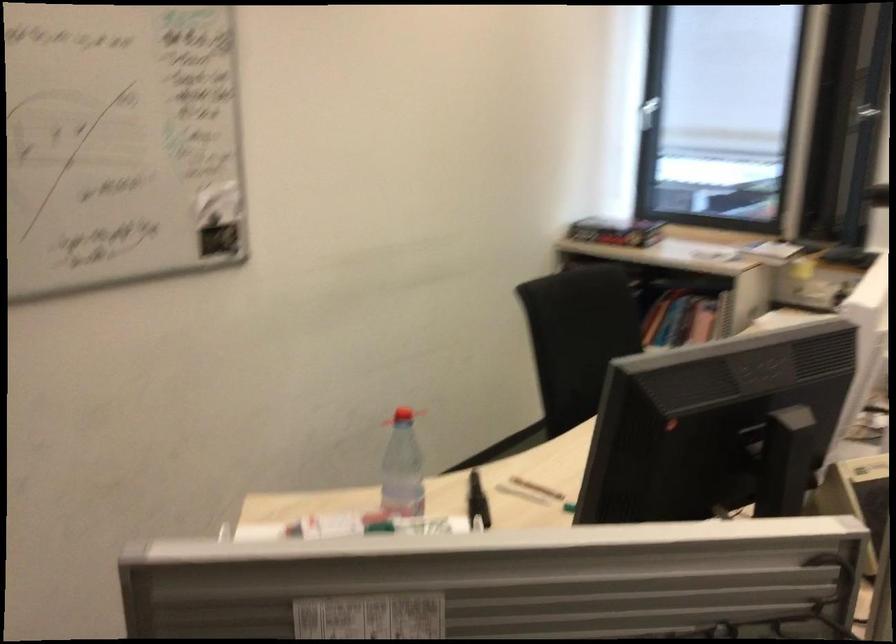
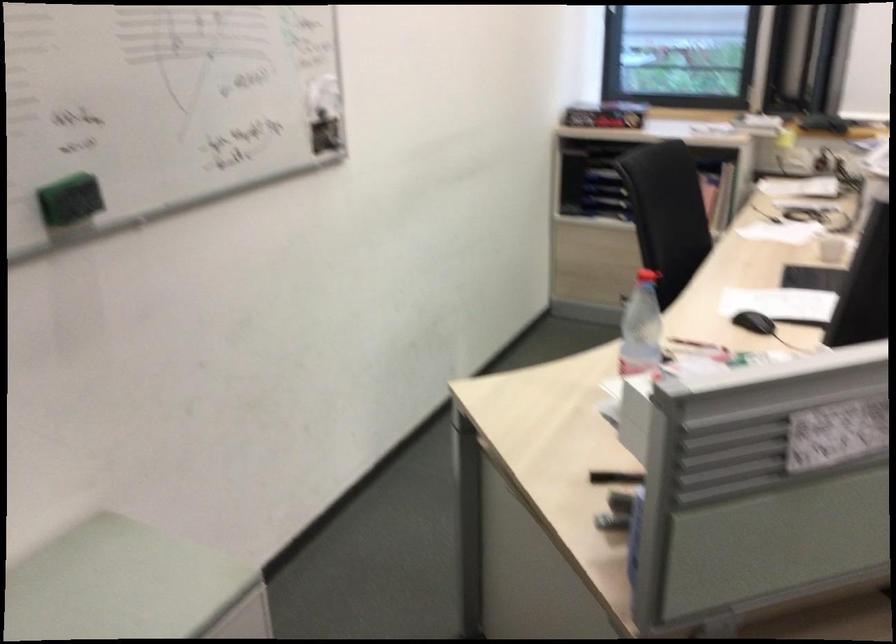
In the second image, find the point that corresponds to (x=544, y=488) in the first image.

(695, 345)